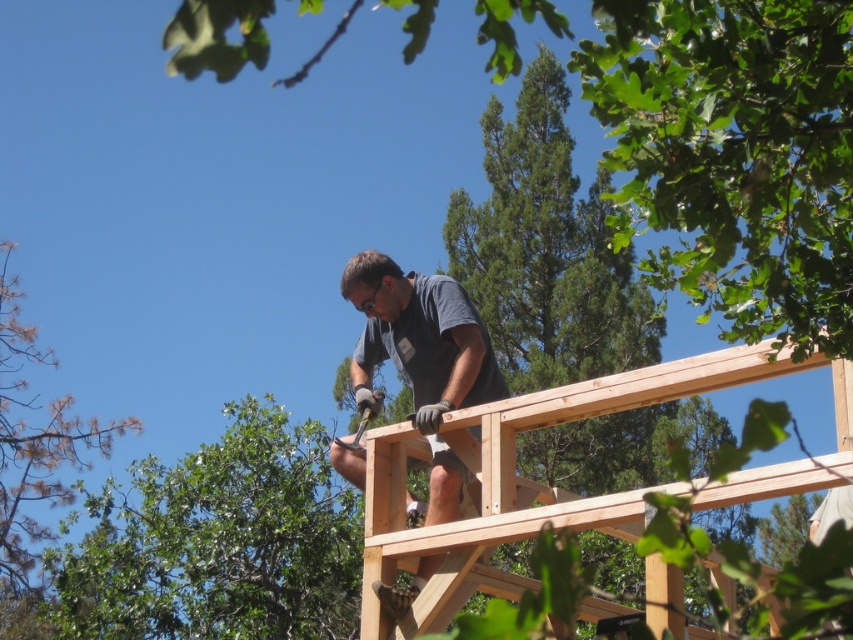
Question: Which object is farther from the camera taking this photo?

Choices:
 (A) dark gray shirt at center
 (B) brown wood tree at left

Answer: (B)

Question: Which of the following is the closest to the observer?

Choices:
 (A) brown wood tree at left
 (B) dark gray shirt at center

Answer: (B)

Question: Among these points, which one is nearest to the camera?

Choices:
 (A) (6, 492)
 (B) (463, 371)

Answer: (B)

Question: Is the position of dark gray shirt at center less distant than that of brown wood tree at left?

Choices:
 (A) yes
 (B) no

Answer: (A)

Question: Does dark gray shirt at center appear on the right side of brown wood tree at left?

Choices:
 (A) yes
 (B) no

Answer: (A)

Question: Is dark gray shirt at center positioned in front of brown wood tree at left?

Choices:
 (A) yes
 (B) no

Answer: (A)